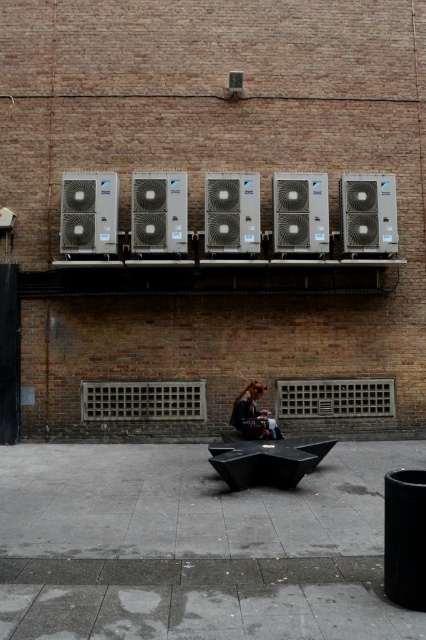
Can you confirm if silver metallic air conditioner at right is positioned to the left of silver metallic air conditioner at center?

In fact, silver metallic air conditioner at right is to the right of silver metallic air conditioner at center.

Does point (351, 200) come behind point (227, 218)?

Yes, point (351, 200) is farther from viewer.

Does point (371, 241) come in front of point (230, 198)?

No.

Where is `silver metallic air conditioner at right`? The width and height of the screenshot is (426, 640). silver metallic air conditioner at right is located at coordinates (368, 212).

Which is behind, point (92, 250) or point (276, 422)?

The point (92, 250) is behind.

This screenshot has width=426, height=640. I want to click on matte silver air conditioner at upper left, so [89, 212].

Does black matte park bench at center have a smaller size compared to silver metallic air conditioner at center?

No.

Can you confirm if black matte park bench at center is positioned to the right of silver metallic air conditioner at center?

Indeed, black matte park bench at center is positioned on the right side of silver metallic air conditioner at center.

Measure the distance between black matte park bench at center and camera.

They are 8.20 meters apart.

Find the location of a particular element. This screenshot has width=426, height=640. black matte park bench at center is located at coordinates (267, 460).